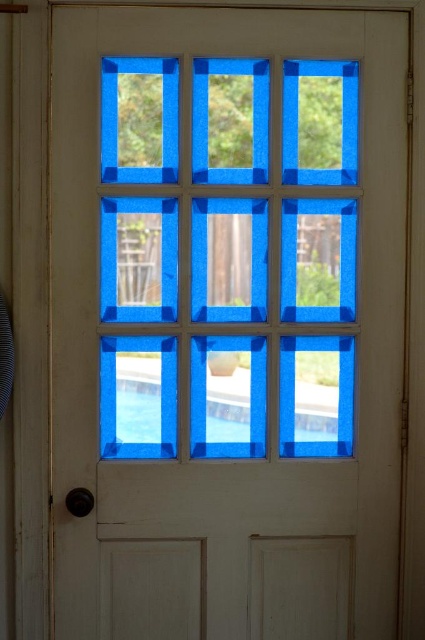
Does transparent blue glass at center have a greater height compared to transparent glass pool at center?

Correct, transparent blue glass at center is much taller as transparent glass pool at center.

Between transparent blue glass at center and transparent glass pool at center, which one appears on the left side from the viewer's perspective?

From the viewer's perspective, transparent blue glass at center appears more on the left side.

This screenshot has width=425, height=640. What are the coordinates of `transparent blue glass at center` in the screenshot? It's located at (227, 260).